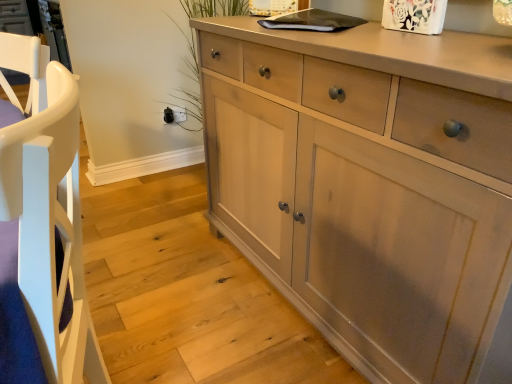
The height and width of the screenshot is (384, 512). What do you see at coordinates (368, 184) in the screenshot? I see `light wood cabinet at center` at bounding box center [368, 184].

You are a GUI agent. You are given a task and a screenshot of the screen. Output one action in this format:
    pyautogui.click(x=<x>, y=<y>)
    Task: Click on the matte gray cabinet at lower left
    The image size is (512, 384).
    Given the screenshot: What is the action you would take?
    pyautogui.click(x=187, y=294)

Is white wood armchair at left bigger than light wood cabinet at center?

No, white wood armchair at left is not bigger than light wood cabinet at center.

How many degrees apart are the facing directions of white wood armchair at left and light wood cabinet at center?

The facing directions of white wood armchair at left and light wood cabinet at center are 12.7 degrees apart.

Is the depth of white wood armchair at left greater than that of light wood cabinet at center?

No, white wood armchair at left is closer to the camera.

Can light wood cabinet at center be found inside white wood armchair at left?

No, white wood armchair at left does not contain light wood cabinet at center.

Consider the image. Does white wood armchair at left have a lesser height compared to matte gray cabinet at lower left?

No.

Based on the photo, which is closer to the camera, (70,218) or (139,309)?

The point (70,218) is closer.

Can you confirm if white wood armchair at left is smaller than matte gray cabinet at lower left?

Yes.

Can you confirm if white wood armchair at left is thinner than matte gray cabinet at lower left?

Indeed, white wood armchair at left has a lesser width compared to matte gray cabinet at lower left.

Is point (85, 211) farther from camera compared to point (64, 175)?

Yes.

From a real-world perspective, who is located lower, matte gray cabinet at lower left or white wood armchair at left?

matte gray cabinet at lower left.

From the image's perspective, is matte gray cabinet at lower left under white wood armchair at left?

Actually, matte gray cabinet at lower left appears above white wood armchair at left in the image.

From a real-world perspective, relative to matte gray cabinet at lower left, is light wood cabinet at center vertically above or below?

Clearly, from a real-world perspective, light wood cabinet at center is above matte gray cabinet at lower left.

Between light wood cabinet at center and matte gray cabinet at lower left, which one has smaller size?

With smaller size is matte gray cabinet at lower left.

From the image's perspective, which object appears higher, light wood cabinet at center or matte gray cabinet at lower left?

light wood cabinet at center, from the image's perspective.

Does matte gray cabinet at lower left have a greater height compared to light wood cabinet at center?

No, matte gray cabinet at lower left is not taller than light wood cabinet at center.

Can you confirm if matte gray cabinet at lower left is smaller than light wood cabinet at center?

Indeed, matte gray cabinet at lower left has a smaller size compared to light wood cabinet at center.

Where is `chest of drawers above the matte gray cabinet at lower left (from the image's perspective)`? chest of drawers above the matte gray cabinet at lower left (from the image's perspective) is located at coordinates (368, 184).

How many degrees apart are the facing directions of matte gray cabinet at lower left and light wood cabinet at center?

The angle between the facing direction of matte gray cabinet at lower left and the facing direction of light wood cabinet at center is 0.118 degrees.

Based on the photo, considering the relative sizes of light wood cabinet at center and white wood armchair at left in the image provided, is light wood cabinet at center smaller than white wood armchair at left?

Incorrect, light wood cabinet at center is not smaller in size than white wood armchair at left.

Which object is more forward, light wood cabinet at center or white wood armchair at left?

white wood armchair at left.

Is light wood cabinet at center in contact with white wood armchair at left?

No, light wood cabinet at center is not touching white wood armchair at left.

Where is `the chest of drawers located behind the white wood armchair at left`? the chest of drawers located behind the white wood armchair at left is located at coordinates (368, 184).

You are a GUI agent. You are given a task and a screenshot of the screen. Output one action in this format:
    pyautogui.click(x=<x>, y=<y>)
    Task: Click on the armchair lying in front of the matte gray cabinet at lower left
    This screenshot has height=384, width=512.
    Given the screenshot: What is the action you would take?
    pyautogui.click(x=46, y=239)

Considering their positions, is white wood armchair at left positioned closer to matte gray cabinet at lower left than light wood cabinet at center?

light wood cabinet at center is positioned closer to the anchor matte gray cabinet at lower left.

Based on their spatial positions, is white wood armchair at left or matte gray cabinet at lower left further from light wood cabinet at center?

white wood armchair at left lies further to light wood cabinet at center than the other object.

Which object lies nearer to the anchor point light wood cabinet at center, matte gray cabinet at lower left or white wood armchair at left?

Among the two, matte gray cabinet at lower left is located nearer to light wood cabinet at center.

Considering their positions, is matte gray cabinet at lower left positioned further to white wood armchair at left than light wood cabinet at center?

matte gray cabinet at lower left lies further to white wood armchair at left than the other object.

From the image, which object appears to be nearer to white wood armchair at left, light wood cabinet at center or matte gray cabinet at lower left?

Based on the image, light wood cabinet at center appears to be nearer to white wood armchair at left.

Based on their spatial positions, is light wood cabinet at center or white wood armchair at left closer to matte gray cabinet at lower left?

light wood cabinet at center is positioned closer to the anchor matte gray cabinet at lower left.

You are a GUI agent. You are given a task and a screenshot of the screen. Output one action in this format:
    pyautogui.click(x=<x>, y=<y>)
    Task: Click on the armchair between matte gray cabinet at lower left and light wood cabinet at center
    Image resolution: width=512 pixels, height=384 pixels.
    Given the screenshot: What is the action you would take?
    pyautogui.click(x=46, y=239)